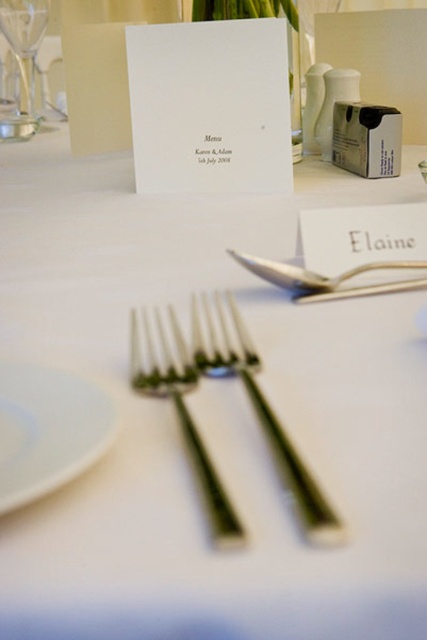
Which of these two, silver metallic fork at center or silver metallic knife at upper center, stands taller?

Standing taller between the two is silver metallic fork at center.

Is point (216, 316) less distant than point (342, 282)?

Yes, point (216, 316) is in front of point (342, 282).

Which is behind, point (300, 490) or point (333, 282)?

The point (333, 282) is more distant.

Image resolution: width=427 pixels, height=640 pixels. In order to click on silver metallic fork at center in this screenshot , I will do `click(260, 412)`.

Which is behind, point (166, 381) or point (38, 28)?

The point (38, 28) is behind.

Between polished silver fork at center and clear glass wine glass at upper left, which one has less height?

With less height is polished silver fork at center.

Is point (207, 468) farther from camera compared to point (26, 33)?

No, it is in front of (26, 33).

The image size is (427, 640). I want to click on polished silver fork at center, so click(x=180, y=410).

Who is positioned more to the left, white glossy plate at lower left or silver metallic knife at upper center?

From the viewer's perspective, white glossy plate at lower left appears more on the left side.

You are a GUI agent. You are given a task and a screenshot of the screen. Output one action in this format:
    pyautogui.click(x=<x>, y=<y>)
    Task: Click on the white glossy plate at lower left
    This screenshot has width=427, height=640.
    Given the screenshot: What is the action you would take?
    click(47, 429)

Identify the location of white glossy plate at lower left. (47, 429).